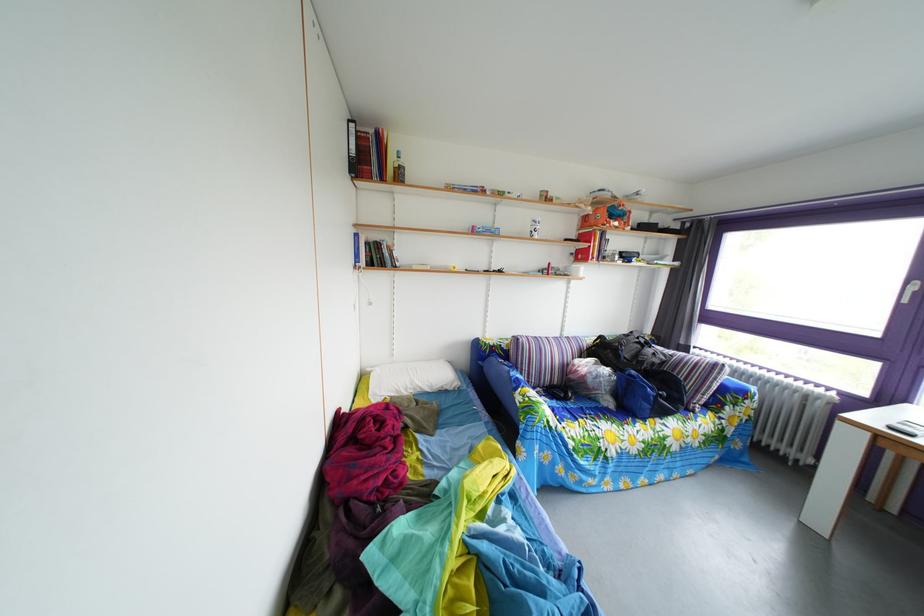
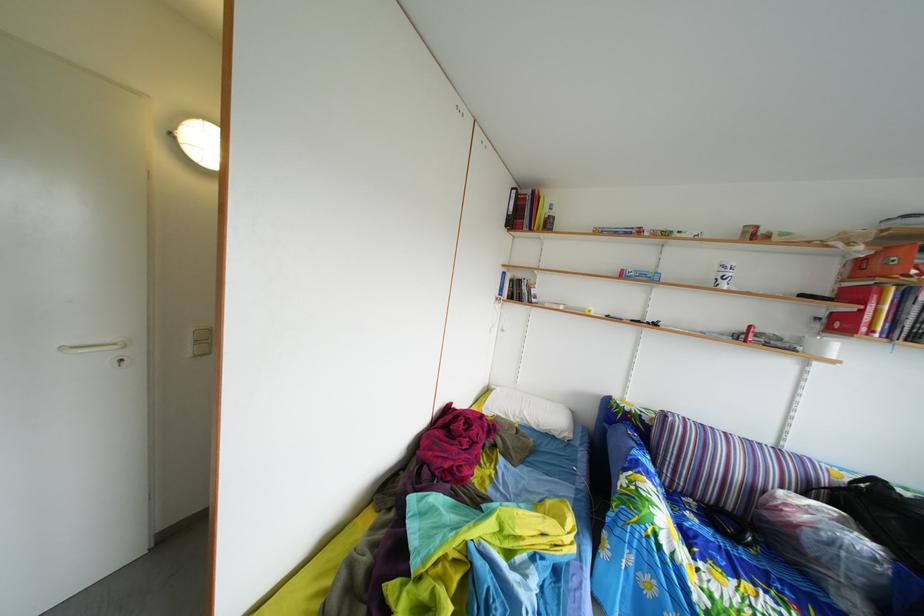
Locate, in the second image, the point that corresponds to [614,359] in the first image.

(886, 515)